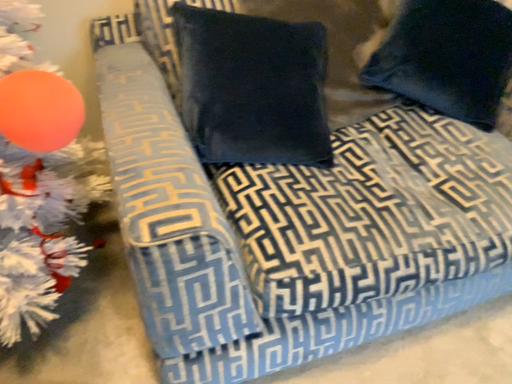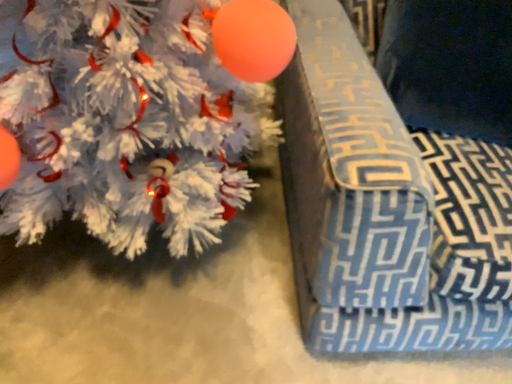
Question: Which way did the camera rotate in the video?

Choices:
 (A) rotated left
 (B) rotated right

Answer: (A)